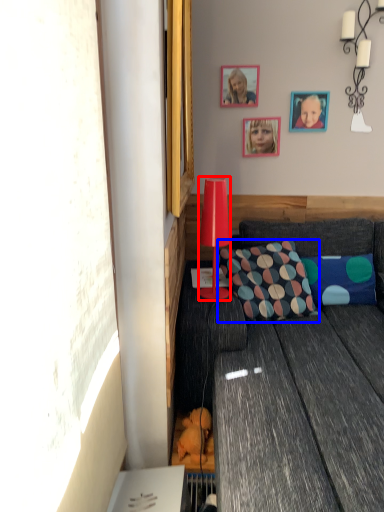
Question: Which of the following is the farthest to the observer, lamp (highlighted by a red box) or pillow (highlighted by a blue box)?

Choices:
 (A) lamp
 (B) pillow

Answer: (B)